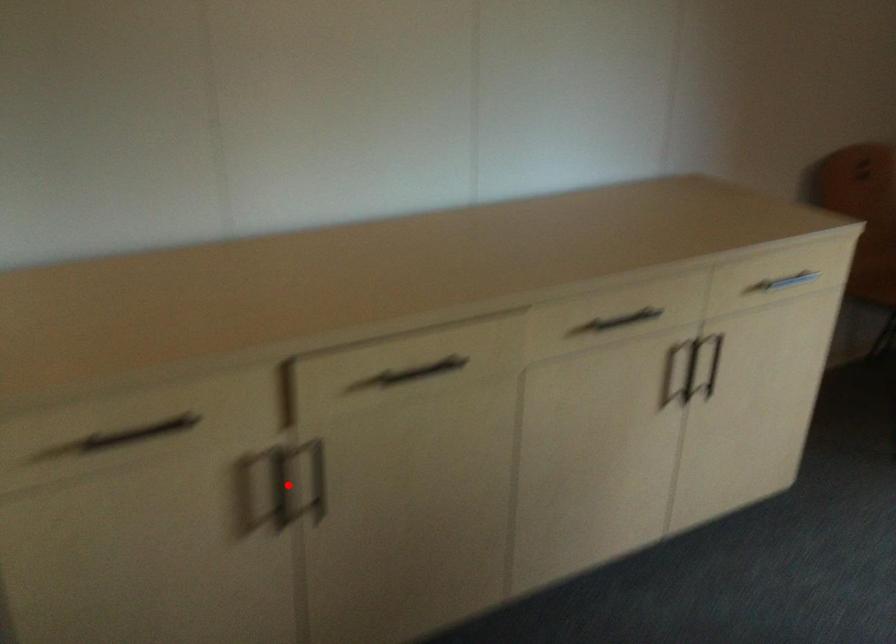
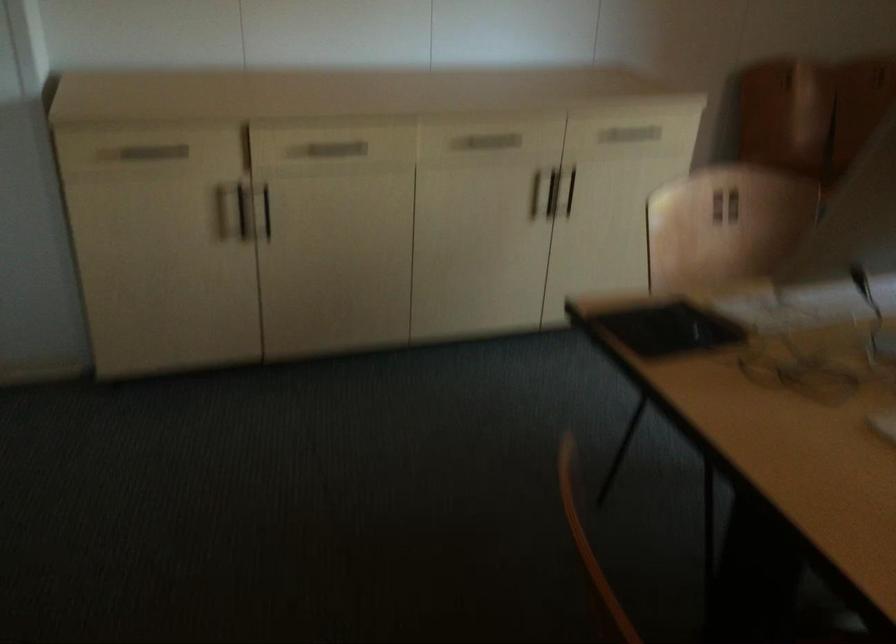
Question: I am providing you with two images of the same scene from different viewpoints. Image1 has a red point marked. In image2, the corresponding 3D location appears at what relative position? Reply with the corresponding letter.

Choices:
 (A) Closer
 (B) Farther

Answer: (B)